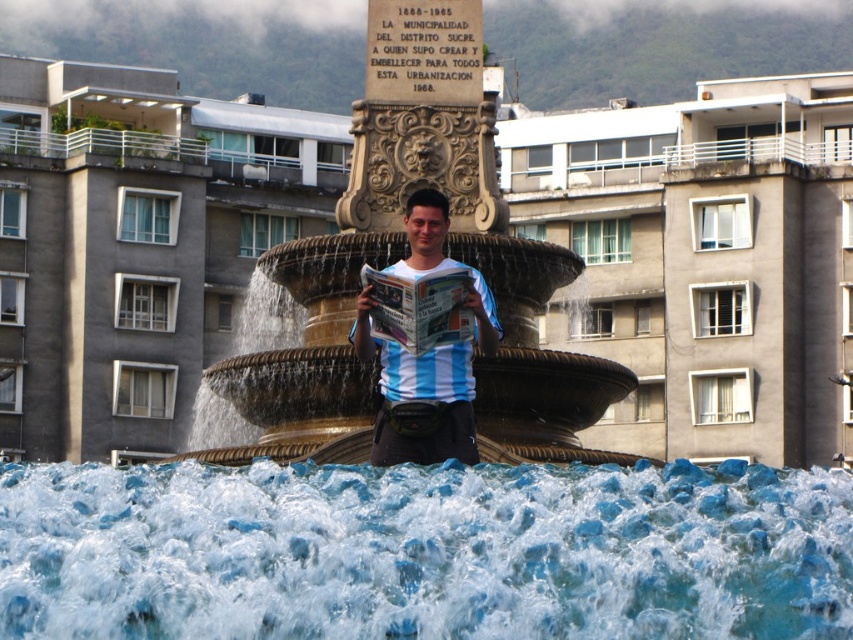
Is point (90, 545) farther from camera compared to point (523, 420)?

No.

Does clear water at fountain center have a greater width compared to gold ornate fountain at center?

Indeed, clear water at fountain center has a greater width compared to gold ornate fountain at center.

Between point (257, 472) and point (364, 189), which one is positioned in front?

Point (257, 472) is more forward.

Locate an element on the screen. The height and width of the screenshot is (640, 853). clear water at fountain center is located at coordinates (424, 552).

Between clear water at fountain center and blue striped shirt at center, which one appears on the right side from the viewer's perspective?

From the viewer's perspective, blue striped shirt at center appears more on the right side.

Image resolution: width=853 pixels, height=640 pixels. What do you see at coordinates (424, 552) in the screenshot? I see `clear water at fountain center` at bounding box center [424, 552].

The height and width of the screenshot is (640, 853). What are the coordinates of `clear water at fountain center` in the screenshot? It's located at (424, 552).

Is gold ornate fountain at center to the right of blue striped shirt at center from the viewer's perspective?

No, gold ornate fountain at center is not to the right of blue striped shirt at center.

Between gold ornate fountain at center and blue striped shirt at center, which one appears on the right side from the viewer's perspective?

From the viewer's perspective, blue striped shirt at center appears more on the right side.

Is point (460, 129) more distant than point (490, 332)?

That is True.

Locate an element on the screen. Image resolution: width=853 pixels, height=640 pixels. gold ornate fountain at center is located at coordinates (402, 257).